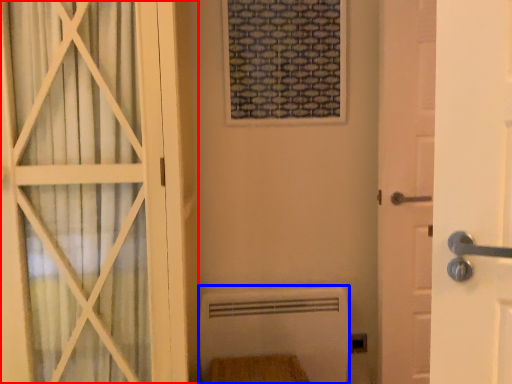
Question: Which object is closer to the camera taking this photo, door (highlighted by a red box) or radiator (highlighted by a blue box)?

Choices:
 (A) door
 (B) radiator

Answer: (A)